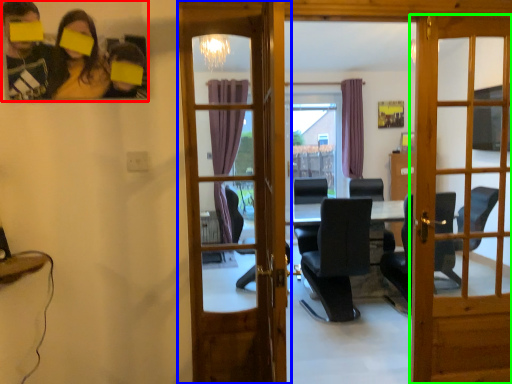
Question: Based on their relative distances, which object is nearer to couple (highlighted by a red box)? Choose from door (highlighted by a blue box) and door (highlighted by a green box).

Choices:
 (A) door
 (B) door

Answer: (B)